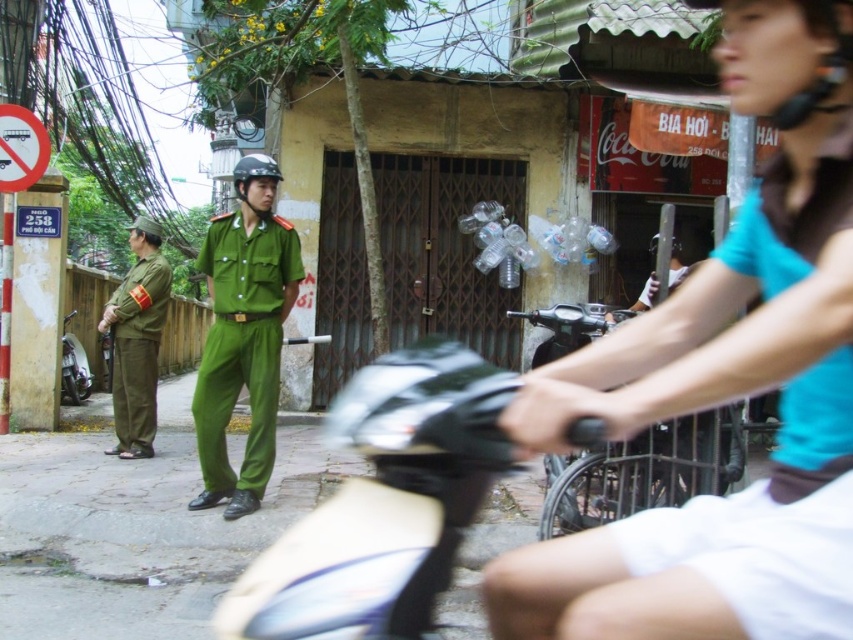
Question: Can you confirm if blue fabric shirt at center is wider than black matte helmet at center?

Choices:
 (A) yes
 (B) no

Answer: (A)

Question: Which point is farther from the camera taking this photo?

Choices:
 (A) (260, 173)
 (B) (729, 531)

Answer: (A)

Question: Is green uniform at center closer to the viewer compared to black matte helmet at center?

Choices:
 (A) yes
 (B) no

Answer: (A)

Question: Can you confirm if blue fabric shirt at center is positioned to the right of black matte helmet at center?

Choices:
 (A) yes
 (B) no

Answer: (A)

Question: Which object is closer to the camera taking this photo?

Choices:
 (A) black matte helmet at center
 (B) blue fabric shirt at center
 (C) green uniform at center
 (D) green uniform at left

Answer: (B)

Question: Which point appears closest to the camera in this image?

Choices:
 (A) (822, 280)
 (B) (235, 193)
 (C) (248, 508)
 (D) (149, 289)

Answer: (A)